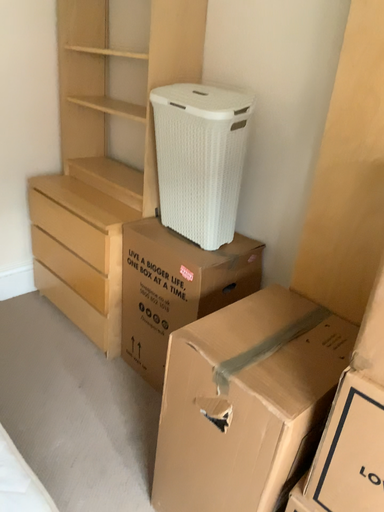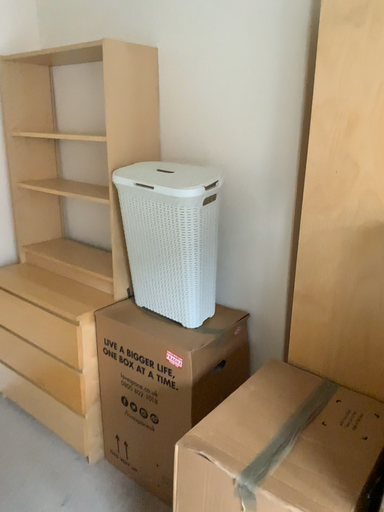
Question: How did the camera likely rotate when shooting the video?

Choices:
 (A) rotated downward
 (B) rotated upward

Answer: (B)